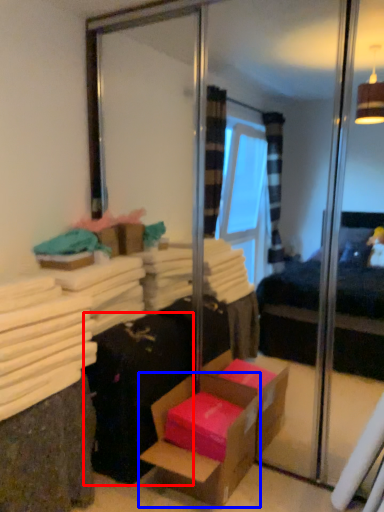
Question: Which point is further to the camera, luggage (highlighted by a red box) or box (highlighted by a blue box)?

Choices:
 (A) luggage
 (B) box

Answer: (A)